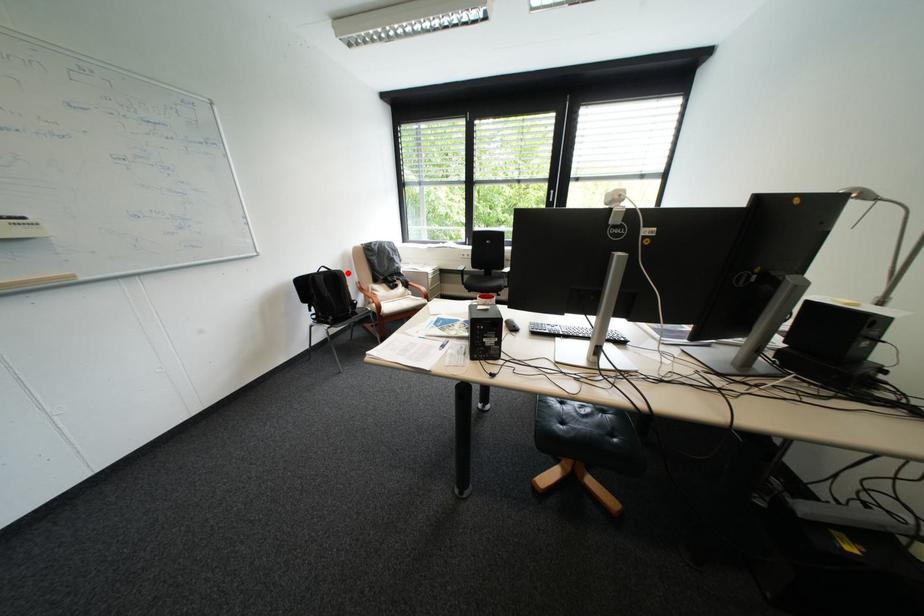
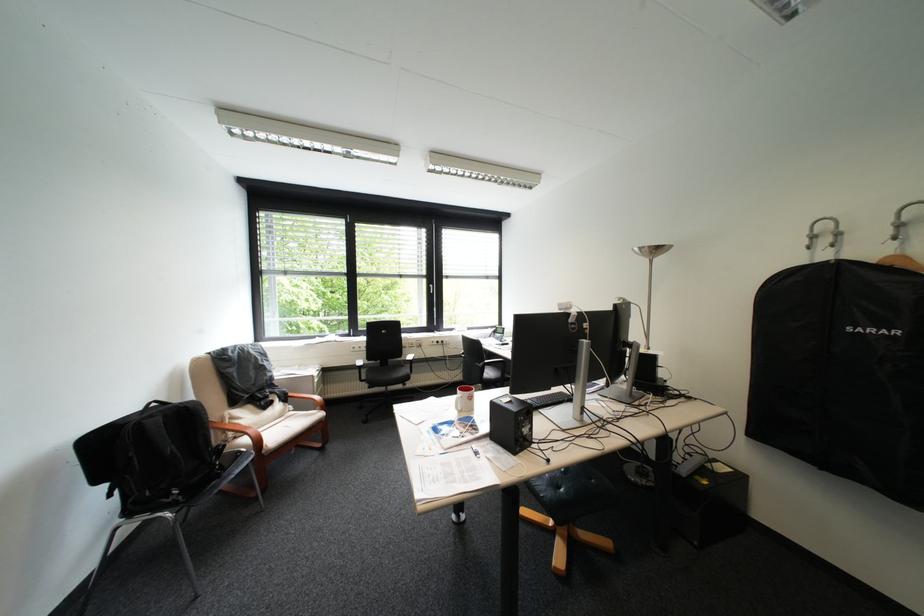
In the second image, find the point that corresponds to the highlighted location in the first image.

(199, 407)